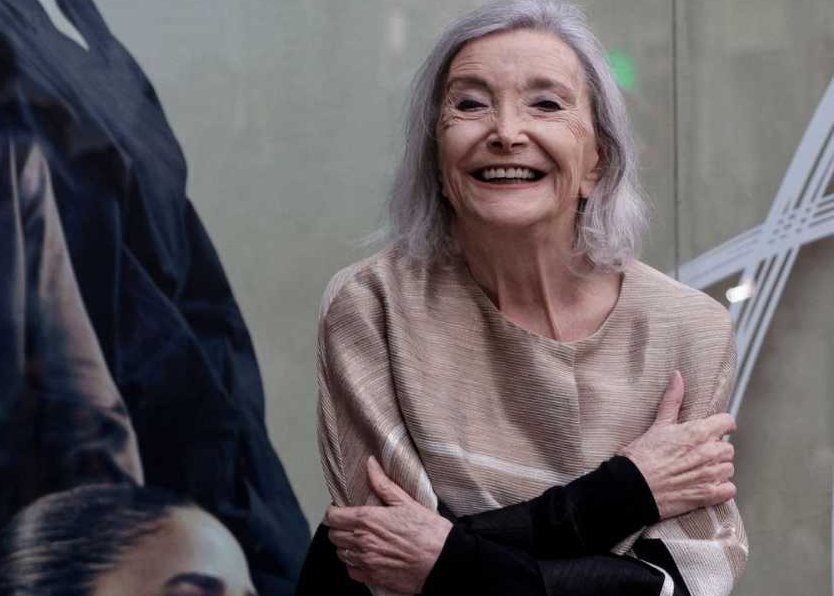
Locate an element on the screen. The height and width of the screenshot is (596, 834). wall is located at coordinates [x=253, y=120], [x=760, y=131].